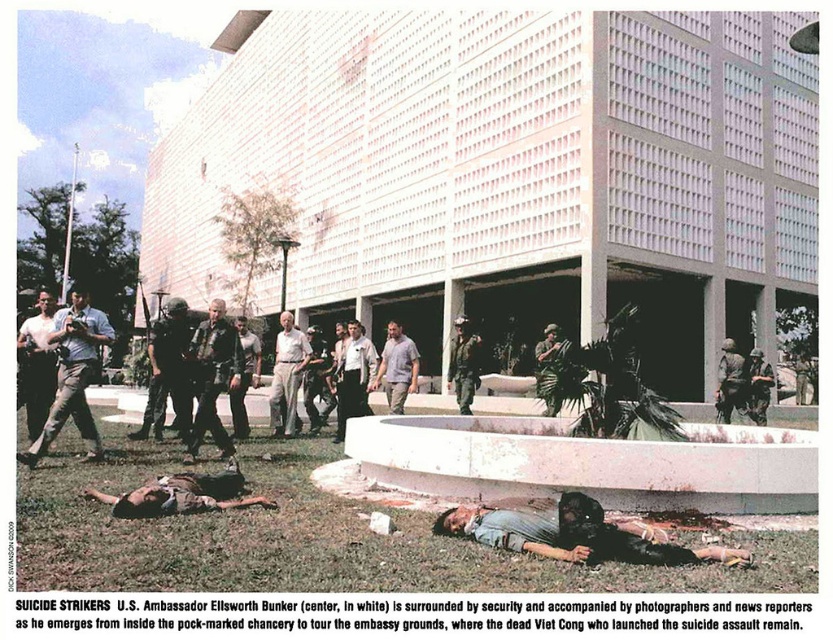
You are a photographer at the scene of an incident outside a government building. You have to capture a clear photo of the gray cotton shirt at center without the dark brown leather jacket at lower left blocking it. What should you do?

Since the dark brown leather jacket at lower left is in front of the gray cotton shirt at center, you should move your position to the side or behind the jacket to ensure the gray cotton shirt at center is visible in your photo.

You are a photographer at the scene. You need to capture a photo that includes both the dark brown leather jacket at lower left and the gray cotton shirt at center. Which direction should you move to ensure both are in frame?

The dark brown leather jacket at lower left is to the left of the gray cotton shirt at center. To include both in the frame, you should move to the left so that the jacket and shirt are centered within your camera view.